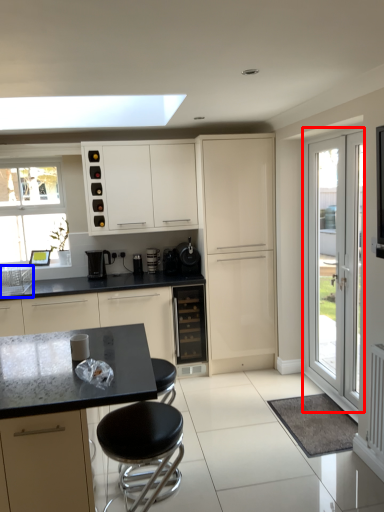
Question: Which object is closer to the camera taking this photo, door (highlighted by a red box) or sink (highlighted by a blue box)?

Choices:
 (A) door
 (B) sink

Answer: (A)